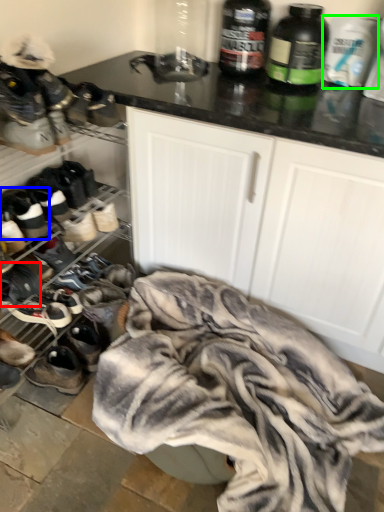
Question: Considering the real-world distances, which object is farthest from footwear (highlighted by a red box)? footwear (highlighted by a blue box) or bottle (highlighted by a green box)?

Choices:
 (A) footwear
 (B) bottle

Answer: (B)